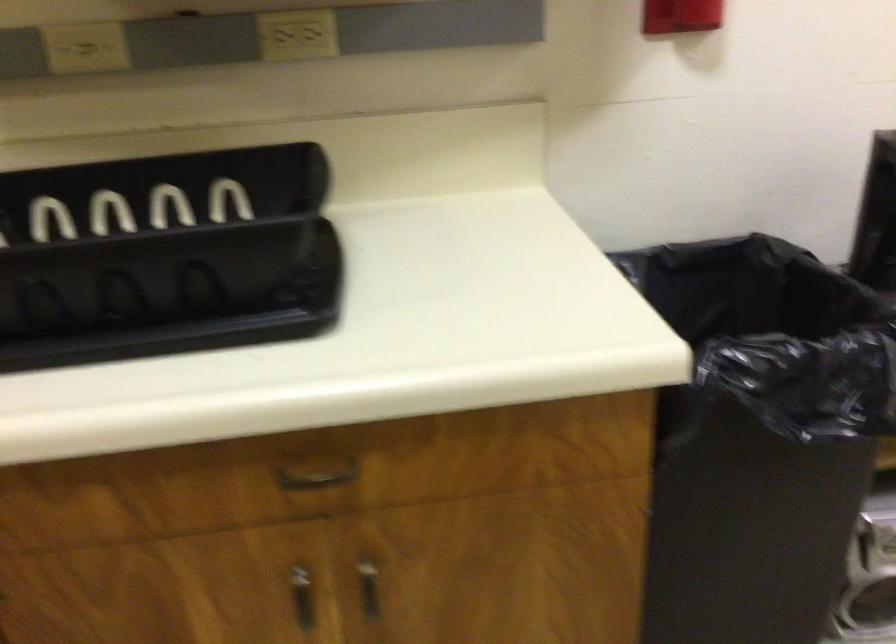
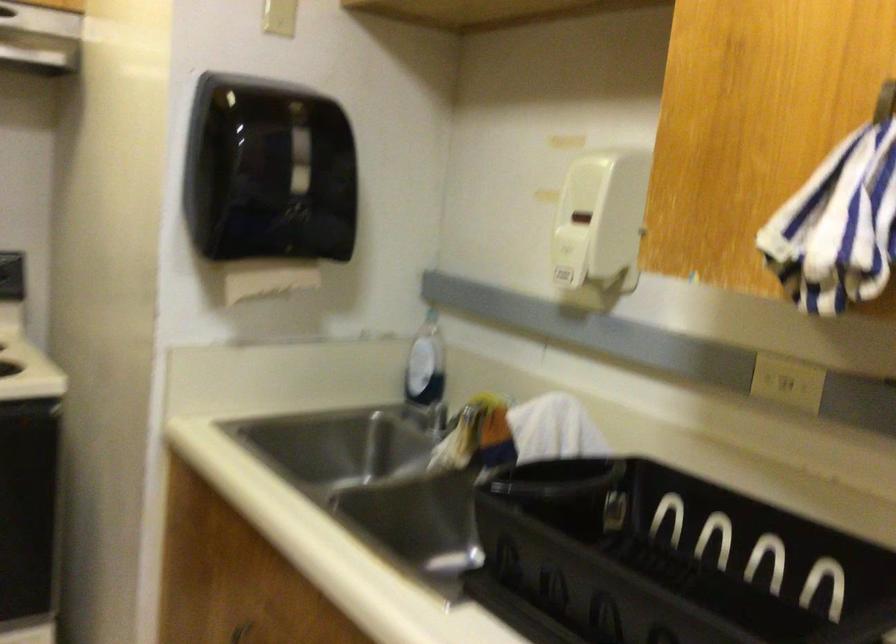
Question: The camera is either moving clockwise (left) or counter-clockwise (right) around the object. The first image is from the beginning of the video and the second image is from the end. Is the camera moving left or right when shooting the video?

Choices:
 (A) Left
 (B) Right

Answer: (B)